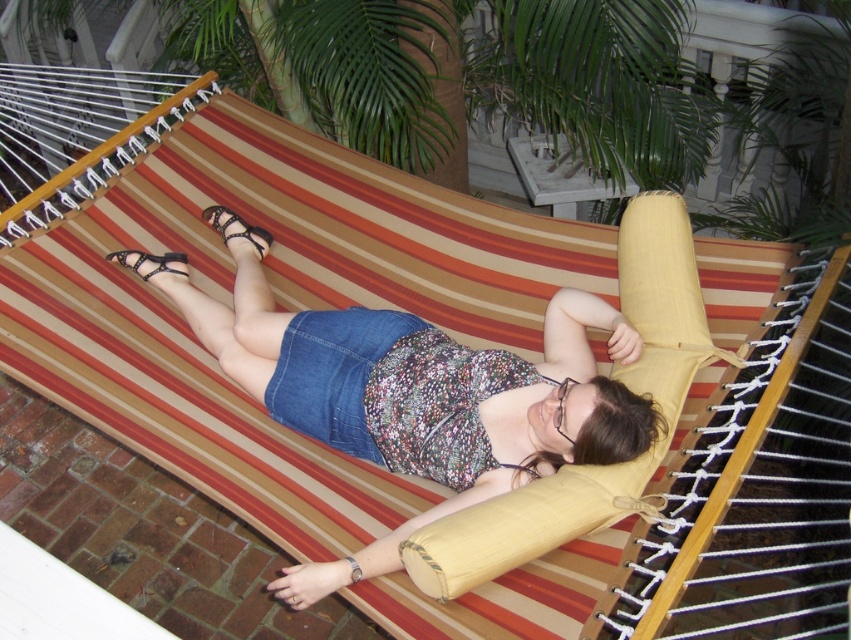
Does denim skirt at center have a lesser width compared to black leather sandal at lower left?

Incorrect, denim skirt at center's width is not less than black leather sandal at lower left's.

Can you confirm if denim skirt at center is taller than black leather sandal at lower left?

Indeed, denim skirt at center has a greater height compared to black leather sandal at lower left.

The width and height of the screenshot is (851, 640). Identify the location of denim skirt at center. (523, 435).

Image resolution: width=851 pixels, height=640 pixels. What do you see at coordinates (236, 230) in the screenshot?
I see `black leather sandal at center` at bounding box center [236, 230].

Is black leather sandal at center to the right of black leather sandal at lower left from the viewer's perspective?

Yes, black leather sandal at center is to the right of black leather sandal at lower left.

Is point (220, 224) in front of point (140, 257)?

No.

This screenshot has width=851, height=640. Identify the location of black leather sandal at center. (236, 230).

Does denim skirt at center have a lesser height compared to black leather sandal at center?

No.

In order to click on denim skirt at center in this screenshot , I will do `click(523, 435)`.

Is point (270, 310) more distant than point (227, 209)?

That is False.

Locate an element on the screen. This screenshot has height=640, width=851. denim skirt at center is located at coordinates (523, 435).